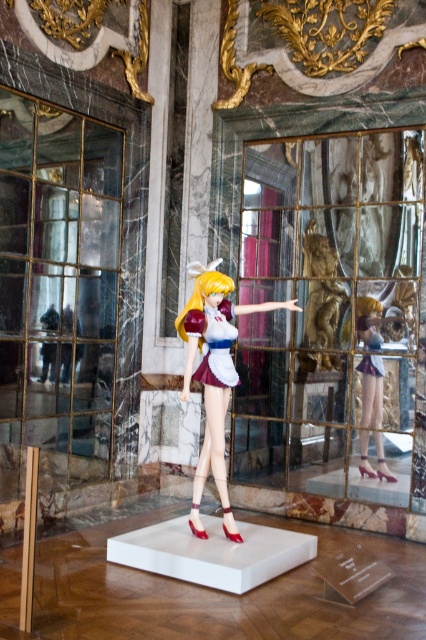
You are a photographer preparing to take a closeup shot of the sailor figurine. The camera lens has a 6 inch focus range. Can you focus on both the satin white dress at center and the golden hair at center simultaneously?

The satin white dress at center and the golden hair at center are 5.81 inches apart, so yes, the camera lens with a 6 inch focus range can focus on both the satin white dress at center and the golden hair at center simultaneously since the distance between them is within the focus range.

You are an interior designer planning to place a new lamp in the room. The lamp must be positioned such that it does not block the view of the satin gold doll at center. Given that the lamp will be placed at point (213,374), will it obstruct the view of the doll?

The point (213,374) indicates the satin gold doll at center, so placing the lamp there would directly block the view of the doll since the lamp would be placed exactly where the doll is located.

You are an interior designer planning to place a new decorative item on the pedestal where the satin gold doll at center is currently positioned. The new item requires a space that is 20 cm in diameter. Can the existing pedestal accommodate this new item?

The satin gold doll at center is located at point coordinates, but without specific size information about the pedestal or the doll, it is impossible to determine if the new item will fit. Additional measurements are needed.